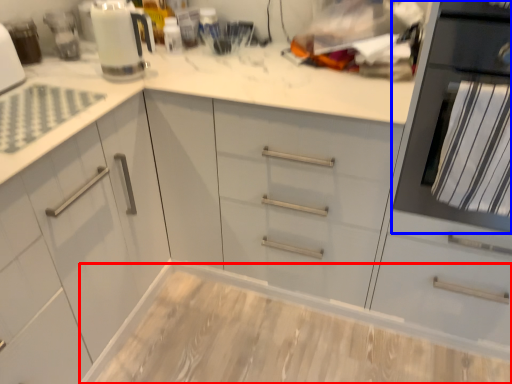
Question: Among these objects, which one is nearest to the camera, counter (highlighted by a red box) or home appliance (highlighted by a blue box)?

Choices:
 (A) counter
 (B) home appliance

Answer: (B)